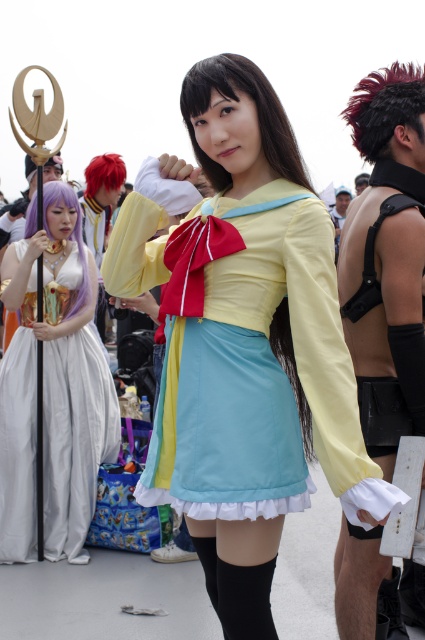
Question: Among these objects, which one is nearest to the camera?

Choices:
 (A) purple silky wig at upper left
 (B) satin yellow wig at center
 (C) yellow satin dress at center
 (D) silky white dress at left

Answer: (C)

Question: Does satin yellow wig at center lie behind shiny red wig at upper left?

Choices:
 (A) no
 (B) yes

Answer: (A)

Question: Which of these objects is positioned farthest from the satin yellow wig at center?

Choices:
 (A) purple silky wig at upper left
 (B) shiny black leather vest at right
 (C) silky white dress at left

Answer: (C)

Question: Is the position of yellow satin dress at center less distant than that of shiny black leather vest at right?

Choices:
 (A) no
 (B) yes

Answer: (B)

Question: Is the position of shiny black leather vest at right less distant than that of silky white dress at left?

Choices:
 (A) yes
 (B) no

Answer: (A)

Question: Which point is closer to the camera?

Choices:
 (A) satin yellow wig at center
 (B) yellow satin dress at center
 (C) silky white dress at left
 (D) dark matte wig at upper right

Answer: (B)